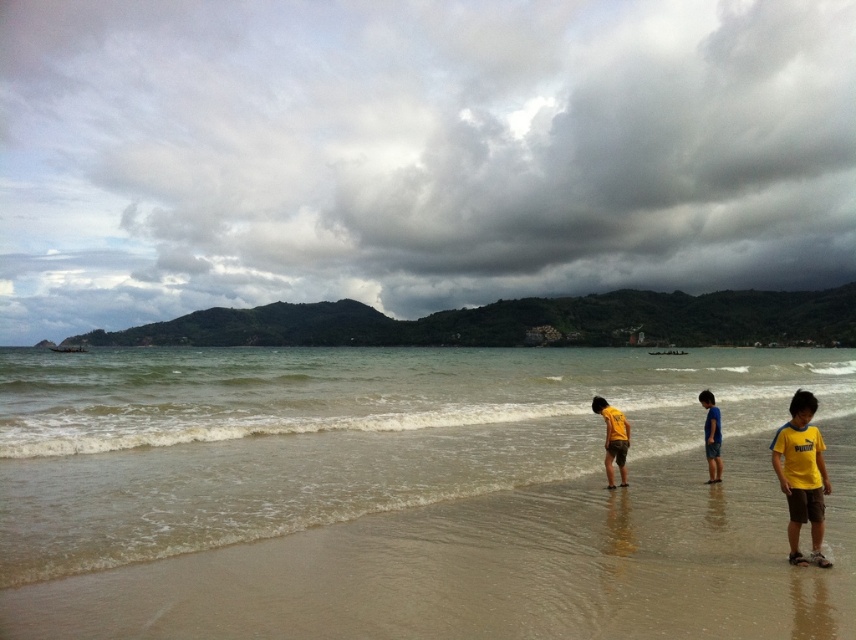
Question: Is clear water at lower center below yellow matte shirt at center?

Choices:
 (A) yes
 (B) no

Answer: (A)

Question: Which object appears farthest from the camera in this image?

Choices:
 (A) yellow cotton shirt at lower right
 (B) clear water at lower center

Answer: (B)

Question: Is clear water at lower center positioned in front of yellow matte shirt at center?

Choices:
 (A) yes
 (B) no

Answer: (A)

Question: Estimate the real-world distances between objects in this image. Which object is closer to the clear water at lower center?

Choices:
 (A) yellow cotton shirt at lower right
 (B) yellow matte shirt at center
 (C) blue cotton shorts at lower right

Answer: (A)

Question: Can you confirm if yellow cotton shirt at lower right is positioned above blue cotton shorts at lower right?

Choices:
 (A) no
 (B) yes

Answer: (B)

Question: Which point appears closest to the camera in this image?

Choices:
 (A) (623, 428)
 (B) (794, 524)

Answer: (B)